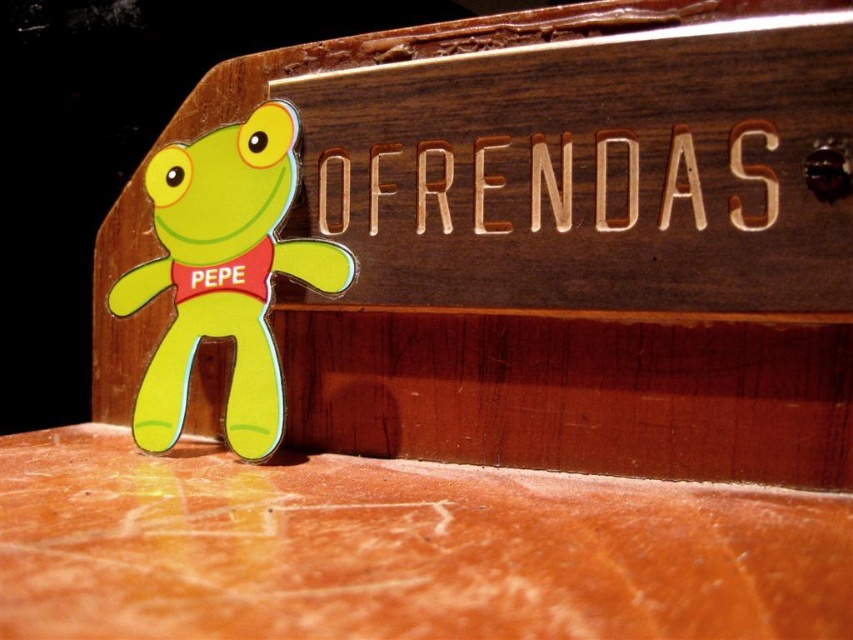
Is wooden sign at center above matte green plush frog at lower left?

Indeed, wooden sign at center is positioned over matte green plush frog at lower left.

Can you confirm if wooden sign at center is shorter than matte green plush frog at lower left?

Yes.

Is point (813, 269) more distant than point (252, 241)?

No, (813, 269) is in front of (252, 241).

Image resolution: width=853 pixels, height=640 pixels. Find the location of `wooden sign at center`. wooden sign at center is located at coordinates (590, 172).

Based on the photo, does wooden sign at upper center appear on the right side of matte green plush frog at lower left?

Correct, you'll find wooden sign at upper center to the right of matte green plush frog at lower left.

Can you confirm if wooden sign at upper center is positioned below matte green plush frog at lower left?

Actually, wooden sign at upper center is above matte green plush frog at lower left.

Image resolution: width=853 pixels, height=640 pixels. I want to click on wooden sign at upper center, so click(566, 237).

The width and height of the screenshot is (853, 640). What do you see at coordinates (566, 237) in the screenshot? I see `wooden sign at upper center` at bounding box center [566, 237].

Does wooden sign at upper center have a lesser width compared to wooden sign at center?

Incorrect, wooden sign at upper center's width is not less than wooden sign at center's.

The width and height of the screenshot is (853, 640). What are the coordinates of `wooden sign at upper center` in the screenshot? It's located at (566, 237).